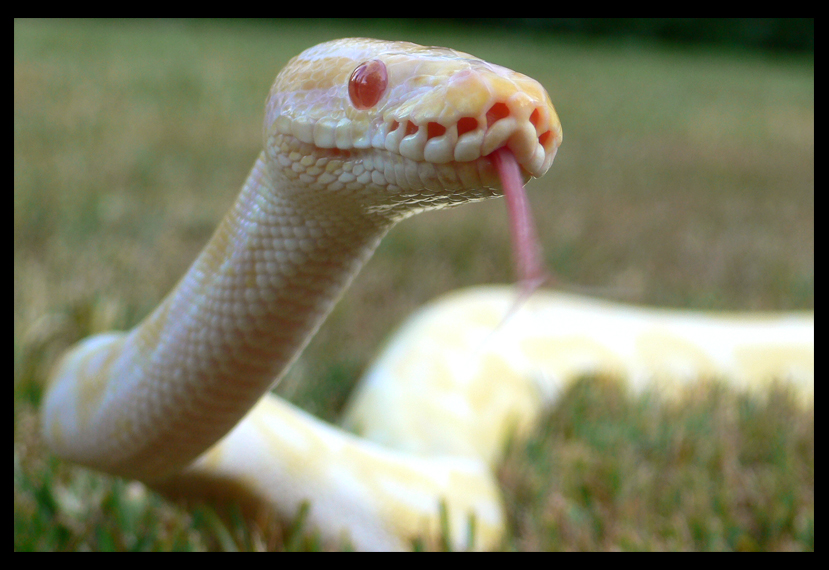
The width and height of the screenshot is (829, 570). Identify the location of fork. (530, 293).